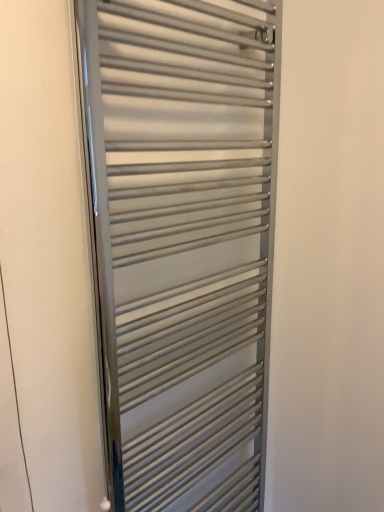
Describe the element at coordinates (182, 243) in the screenshot. I see `satin nickel towel rack at center` at that location.

Where is `satin nickel towel rack at center`? satin nickel towel rack at center is located at coordinates (182, 243).

Image resolution: width=384 pixels, height=512 pixels. Identify the location of satin nickel towel rack at center. (182, 243).